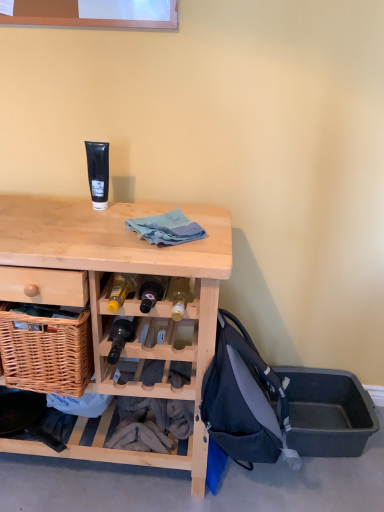
Question: Is dark blue fabric backpack at lower right to the left or to the right of black matte tube at upper center in the image?

Choices:
 (A) right
 (B) left

Answer: (A)

Question: Considering the positions of dark blue fabric backpack at lower right and black matte tube at upper center in the image, is dark blue fabric backpack at lower right taller or shorter than black matte tube at upper center?

Choices:
 (A) tall
 (B) short

Answer: (A)

Question: Which is nearer to the matte black bottle at center?

Choices:
 (A) black matte tube at upper center
 (B) blue cotton cloth at center
 (C) gray plastic storage box at lower right
 (D) dark blue fabric backpack at lower right
 (E) light wood desk at center

Answer: (E)

Question: Which object is the farthest from the matte black bottle at center?

Choices:
 (A) dark blue fabric backpack at lower right
 (B) blue cotton cloth at center
 (C) light wood desk at center
 (D) black matte tube at upper center
 (E) gray plastic storage box at lower right

Answer: (E)